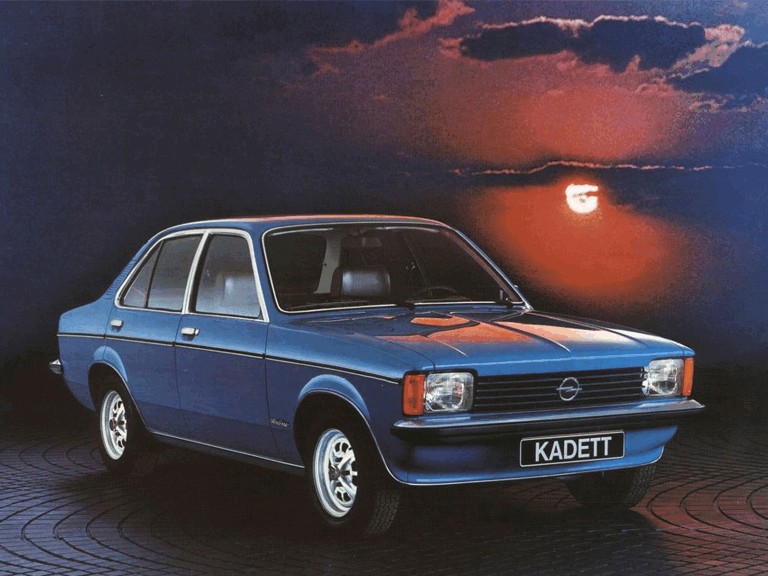
The height and width of the screenshot is (576, 768). I want to click on seat headrests, so click(372, 282), click(237, 284).